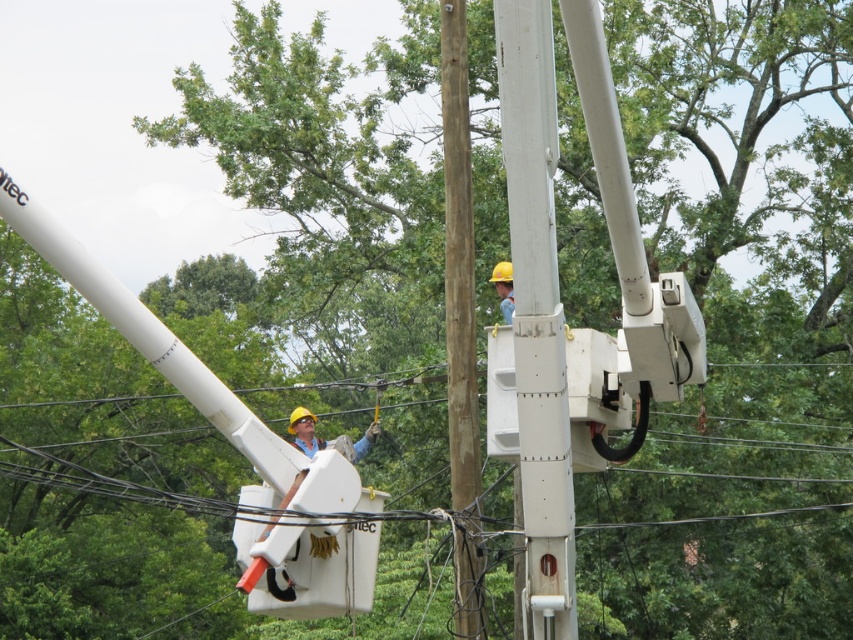
Question: Is white matte/rough telegraph pole at center below yellow hard hat at upper center?

Choices:
 (A) no
 (B) yes

Answer: (B)

Question: Which point appears closest to the camera in this image?

Choices:
 (A) pyautogui.click(x=451, y=211)
 (B) pyautogui.click(x=506, y=314)

Answer: (A)

Question: Is white matte/rough telegraph pole at center thinner than brown wood telegraph pole at center?

Choices:
 (A) yes
 (B) no

Answer: (A)

Question: Among these points, which one is nearest to the camera?

Choices:
 (A) (561, 433)
 (B) (508, 308)

Answer: (A)

Question: Can you confirm if white matte/rough telegraph pole at center is positioned to the right of yellow hard hat at upper center?

Choices:
 (A) no
 (B) yes

Answer: (A)

Question: Which of the following is the closest to the observer?

Choices:
 (A) (511, 312)
 (B) (506, 122)

Answer: (B)